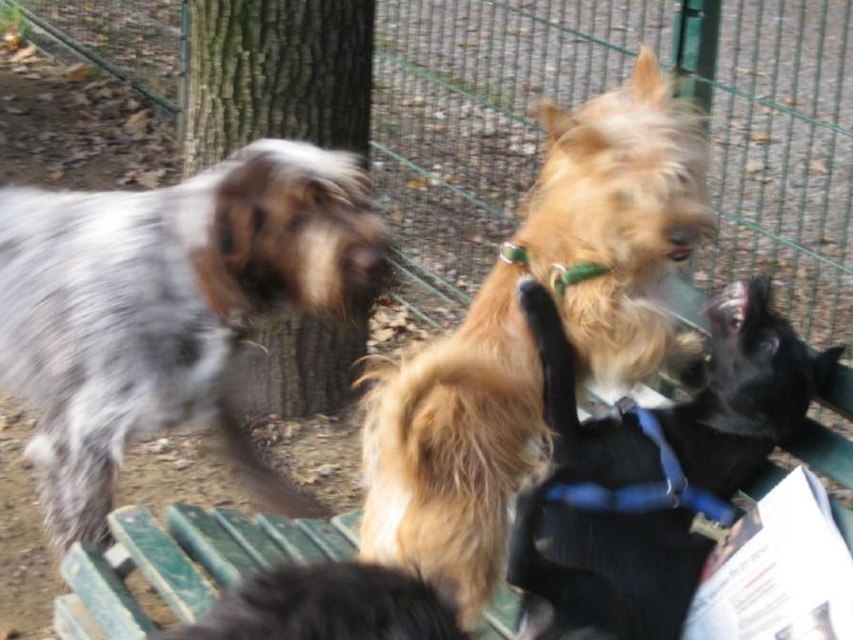
Is point (230, 221) farther from viewer compared to point (722, 307)?

That is True.

Does speckled fur dog at left come in front of shaggy golden fur at center?

No, it is behind shaggy golden fur at center.

Which is behind, point (254, 189) or point (720, 436)?

The point (254, 189) is more distant.

At what (x,y) coordinates should I click in order to perform the action: click on speckled fur dog at left. Please return your answer as a coordinate pair (x, y). This screenshot has height=640, width=853. Looking at the image, I should click on (169, 308).

In order to click on golden fur dog at center in this screenshot , I will do `click(529, 336)`.

Is golden fur dog at center above shaggy golden fur at center?

Yes.

The width and height of the screenshot is (853, 640). I want to click on golden fur dog at center, so click(x=529, y=336).

Image resolution: width=853 pixels, height=640 pixels. Identify the location of golden fur dog at center. (529, 336).

Which is below, golden fur dog at center or black fur dog at center?

Positioned lower is black fur dog at center.

Is point (595, 308) more distant than point (316, 637)?

Yes, point (595, 308) is farther from viewer.

Identify the location of golden fur dog at center. (529, 336).